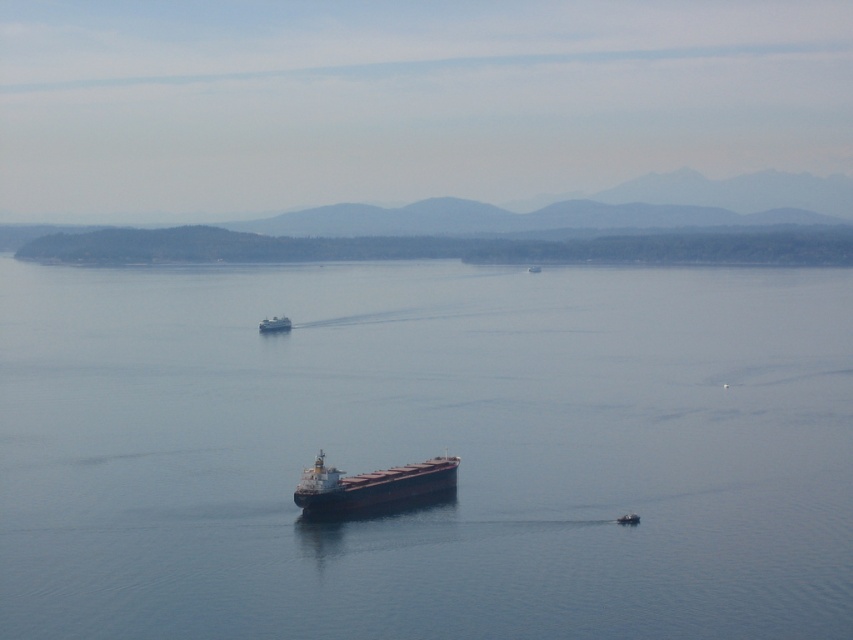
Question: Which point is farther from the camera taking this photo?

Choices:
 (A) (577, 566)
 (B) (416, 472)

Answer: (B)

Question: Which point appears farthest from the camera in this image?

Choices:
 (A) (728, 349)
 (B) (527, 269)
 (C) (276, 317)

Answer: (B)

Question: Can you confirm if dark brown matte cargo ship at center is positioned below metallic gray ship at center?

Choices:
 (A) no
 (B) yes

Answer: (B)

Question: Does dark blue water at center appear on the right side of metallic gray ship at center?

Choices:
 (A) yes
 (B) no

Answer: (B)

Question: Which object is farther from the camera taking this photo?

Choices:
 (A) dark brown matte cargo ship at center
 (B) metallic gray boat at center
 (C) metallic gray ship at center
 (D) dark blue water at center

Answer: (C)

Question: Does metallic gray boat at center lie behind metallic gray ship at center?

Choices:
 (A) yes
 (B) no

Answer: (B)